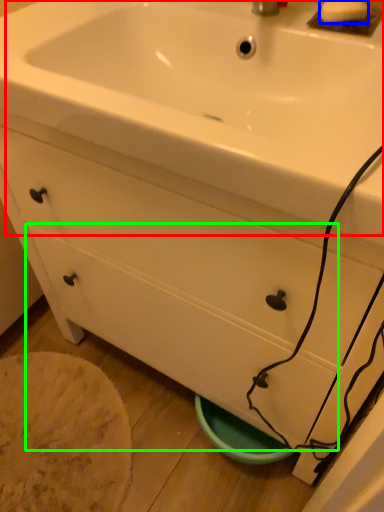
Question: Based on their relative distances, which object is farther from sink (highlighted by a red box)? Choose from soap (highlighted by a blue box) and drawer (highlighted by a green box).

Choices:
 (A) soap
 (B) drawer

Answer: (B)